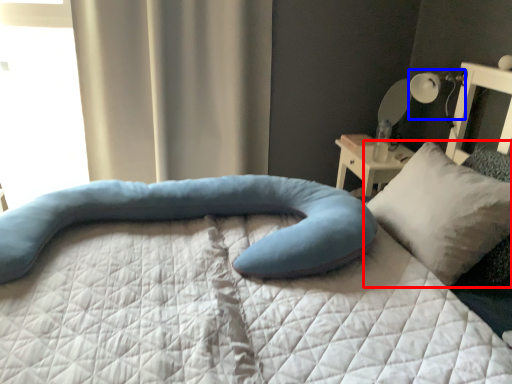
Question: Which of the following is the closest to the observer, pillow (highlighted by a red box) or table lamp (highlighted by a blue box)?

Choices:
 (A) pillow
 (B) table lamp

Answer: (A)